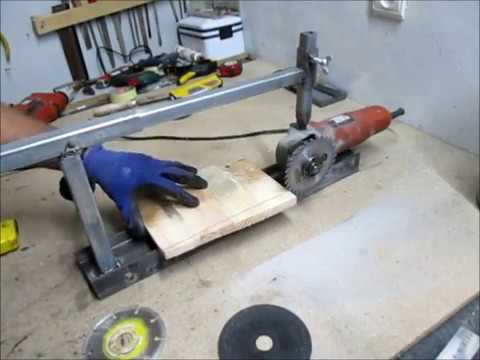
Identify the location of work bench. (326, 248).